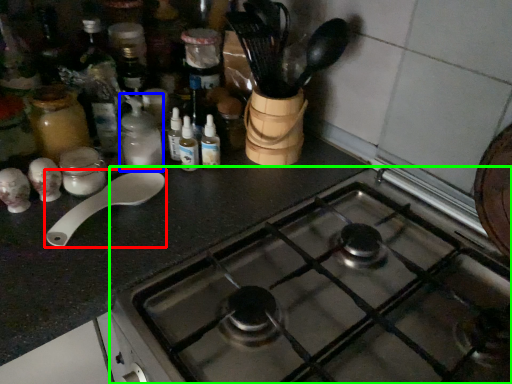
Question: Which object is the closest to the spoon (highlighted by a red box)? Choose among these: bottle (highlighted by a blue box) or gas stove (highlighted by a green box).

Choices:
 (A) bottle
 (B) gas stove

Answer: (A)